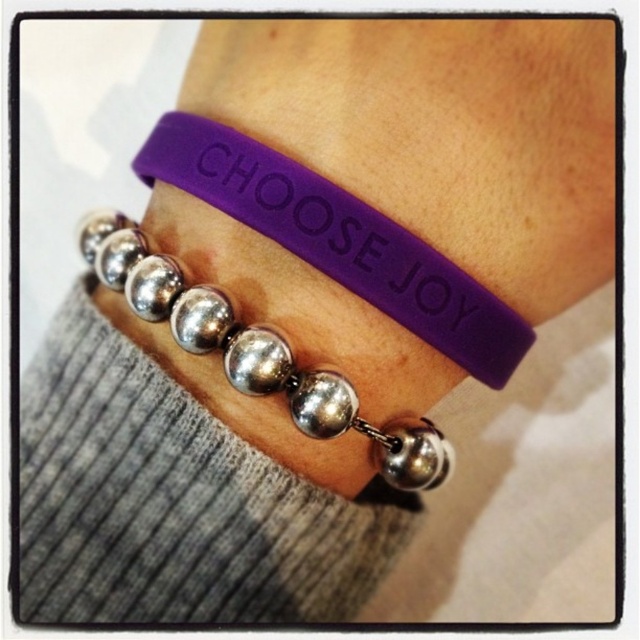
Question: Which point is farther to the camera?

Choices:
 (A) (396, 224)
 (B) (273, 362)

Answer: (A)

Question: From the image, what is the correct spatial relationship of purple rubber bracelet at upper center in relation to silver metallic bead at center?

Choices:
 (A) left
 (B) right

Answer: (B)

Question: Is purple rubber bracelet at upper center positioned behind silver metallic bead at center?

Choices:
 (A) yes
 (B) no

Answer: (A)

Question: Does purple rubber bracelet at upper center appear over silver metallic bead at center?

Choices:
 (A) no
 (B) yes

Answer: (B)